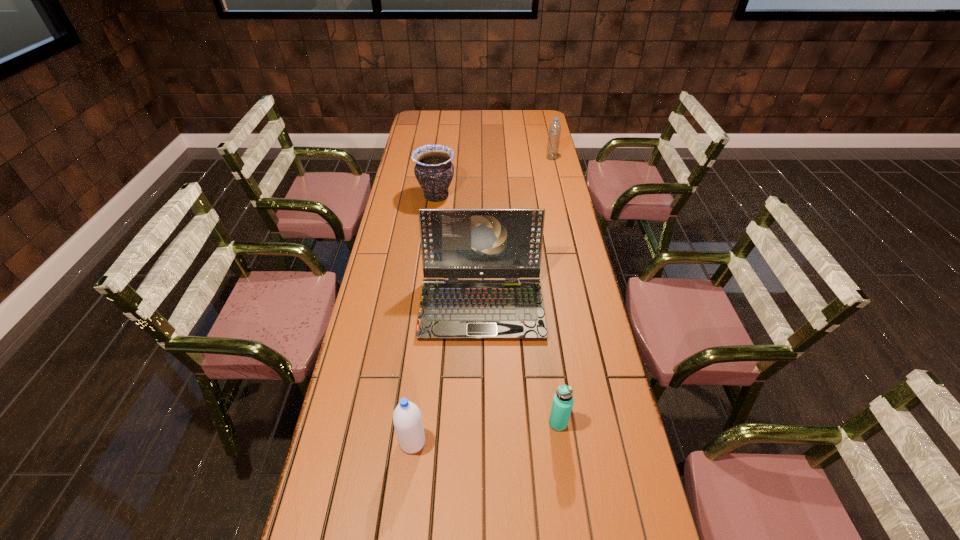
Where is `the fourth closest object relative to the pottery`? the fourth closest object relative to the pottery is located at coordinates (407, 419).

Locate an element on the screen. object that is the third nearest to the second farthest object is located at coordinates (563, 400).

At what (x,y) coordinates should I click in order to perform the action: click on water bottle that is the closest one to the leftmost water bottle. Please return your answer as a coordinate pair (x, y). Looking at the image, I should click on (563, 400).

Find the location of `water bottle that stands as the second closest to the tallest object`. water bottle that stands as the second closest to the tallest object is located at coordinates (407, 419).

The image size is (960, 540). I want to click on free spot that satisfies the following two spatial constraints: 1. on the front handle of the second water bottle from left to right; 2. on the right side of the fourth nearest object, so click(x=407, y=423).

I want to click on free space that satisfies the following two spatial constraints: 1. on the front handle of the second farthest object; 2. on the left side of the leftmost water bottle, so click(405, 442).

Identify the location of vacant space that satisfies the following two spatial constraints: 1. on the front handle of the leftmost water bottle; 2. on the left side of the second farthest object. The width and height of the screenshot is (960, 540). (405, 442).